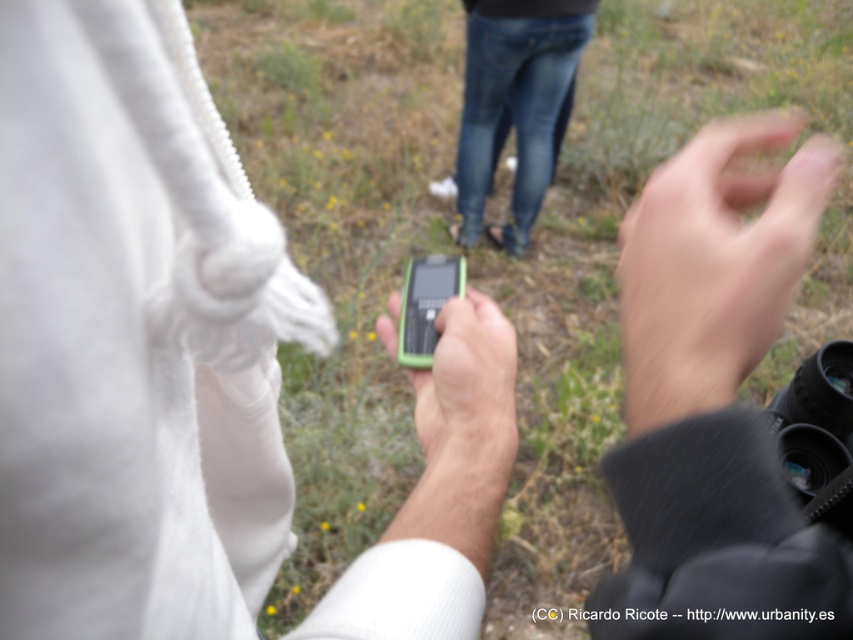
You are standing at the point marked by the coordinates point (103,429) and want to throw a ball to someone standing 12 inches away from you. Can you reach them with a throw?

The distance between point (103,429) and the viewer is 11.85 inches, so yes, you can reach them with a throw since it is slightly less than 12 inches.